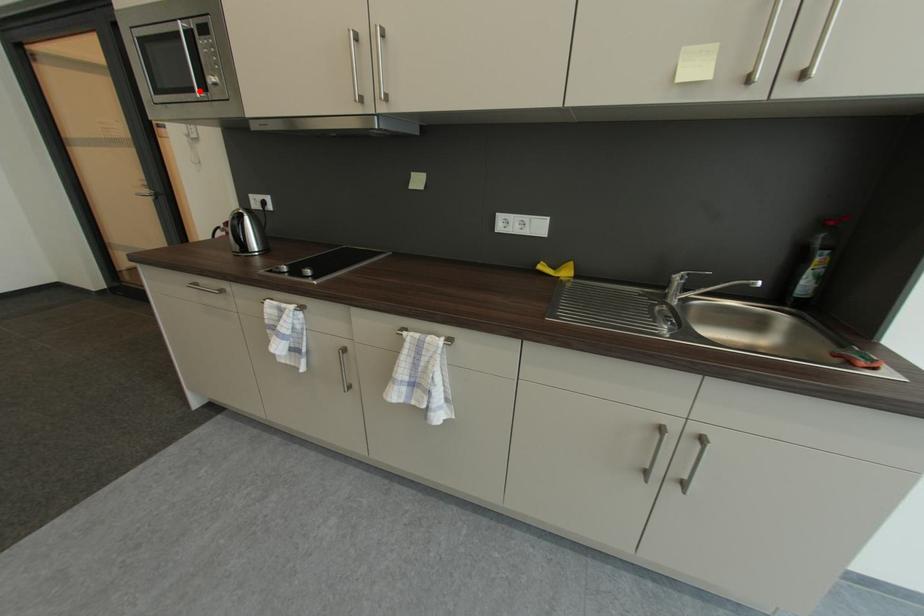
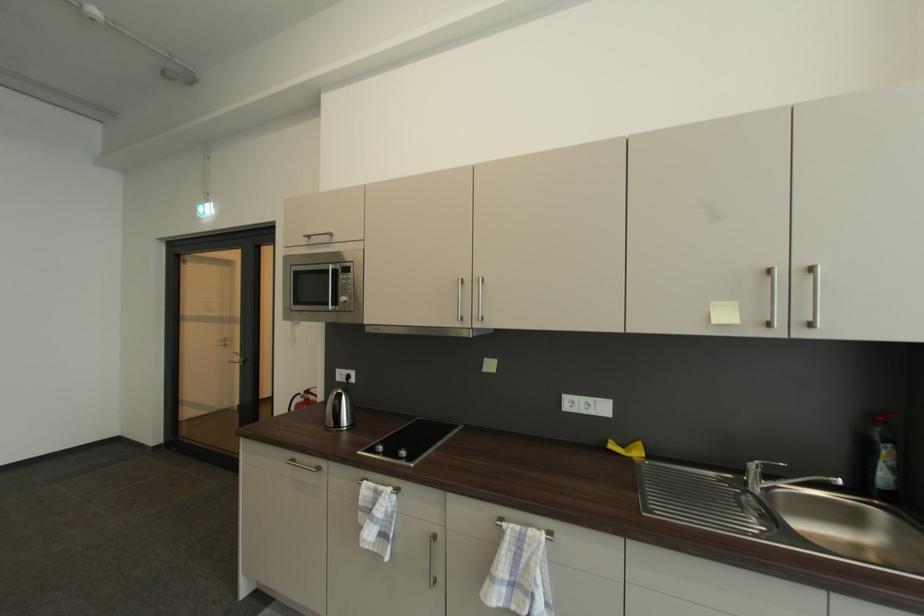
Locate, in the second image, the point that corresponds to the highlighted location in the first image.

(334, 306)